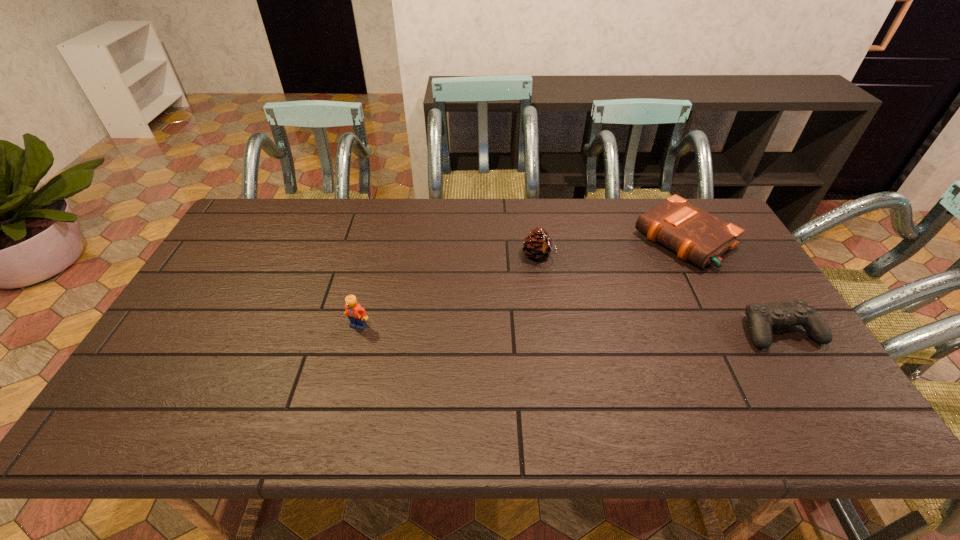
Identify the location of unoccupied position between the Lego and the control. 569,328.

You are a GUI agent. You are given a task and a screenshot of the screen. Output one action in this format:
    pyautogui.click(x=<x>, y=<y>)
    Task: Click on the free area in between the Bible and the leftmost object
    
    Given the screenshot: What is the action you would take?
    pyautogui.click(x=521, y=282)

Select which object appears as the third closest to the control. Please provide its 2D coordinates. Your answer should be formatted as a tuple, i.e. [(x, y)], where the tuple contains the x and y coordinates of a point satisfying the conditions above.

[(357, 315)]

The image size is (960, 540). What are the coordinates of `object that is the third closest to the Bible` in the screenshot? It's located at (357, 315).

The width and height of the screenshot is (960, 540). I want to click on vacant region that satisfies the following two spatial constraints: 1. on the back side of the Bible; 2. on the left side of the second object from left to right, so point(536,239).

Identify the location of vacant space that satisfies the following two spatial constraints: 1. on the front-facing side of the control; 2. on the left side of the leftmost object. (357, 331).

This screenshot has width=960, height=540. Find the location of `vacant point that satisfies the following two spatial constraints: 1. on the front-facing side of the Lego; 2. on the right side of the control`. vacant point that satisfies the following two spatial constraints: 1. on the front-facing side of the Lego; 2. on the right side of the control is located at coordinates [x=357, y=331].

You are a GUI agent. You are given a task and a screenshot of the screen. Output one action in this format:
    pyautogui.click(x=<x>, y=<y>)
    Task: Click on the blank area in the image that satisfies the following two spatial constraints: 1. on the front-facing side of the Lego; 2. on the right side of the control
    
    Given the screenshot: What is the action you would take?
    pyautogui.click(x=357, y=331)